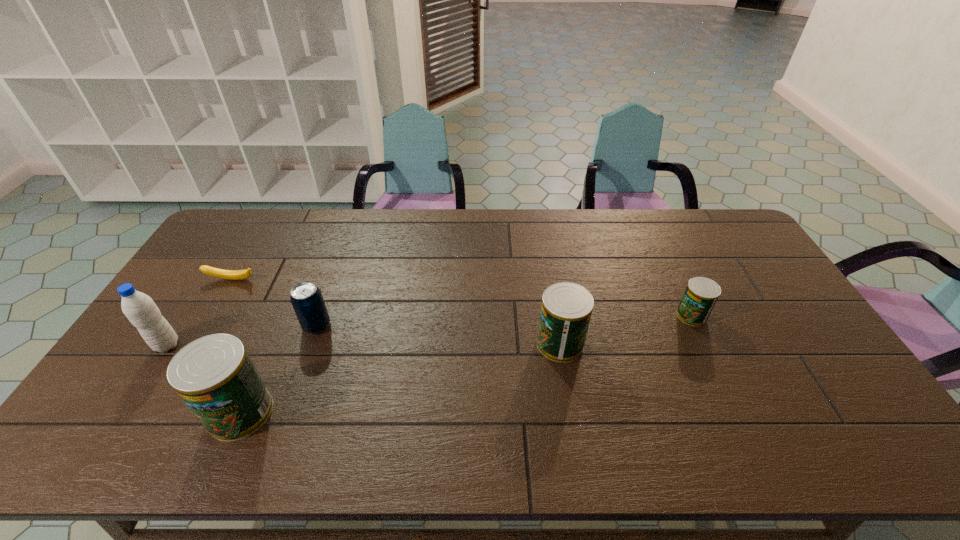
I want to click on vacant space at the near edge of the desktop, so click(747, 410).

This screenshot has height=540, width=960. I want to click on vacant space at the left edge, so click(207, 259).

Image resolution: width=960 pixels, height=540 pixels. I want to click on vacant area at the right edge of the desktop, so click(x=833, y=379).

In the image, there is a desktop. Find the location of `vacant space at the far left corner`. vacant space at the far left corner is located at coordinates (244, 218).

Identify the location of vacant space at the near left corner. (130, 406).

The width and height of the screenshot is (960, 540). Find the location of `free region at the far right corner of the desktop`. free region at the far right corner of the desktop is located at coordinates (717, 239).

Locate an element on the screen. The image size is (960, 540). free region at the near right corner of the desktop is located at coordinates [x=828, y=387].

Identify the location of free space that is in between the second shortest object and the second object from right to left. The width and height of the screenshot is (960, 540). (626, 329).

Identify the location of free space that is in between the second object from right to left and the water bottle. This screenshot has height=540, width=960. (364, 345).

Find the location of a particular element. This screenshot has height=540, width=960. free space that is in between the third shortest object and the second shortest object is located at coordinates (504, 321).